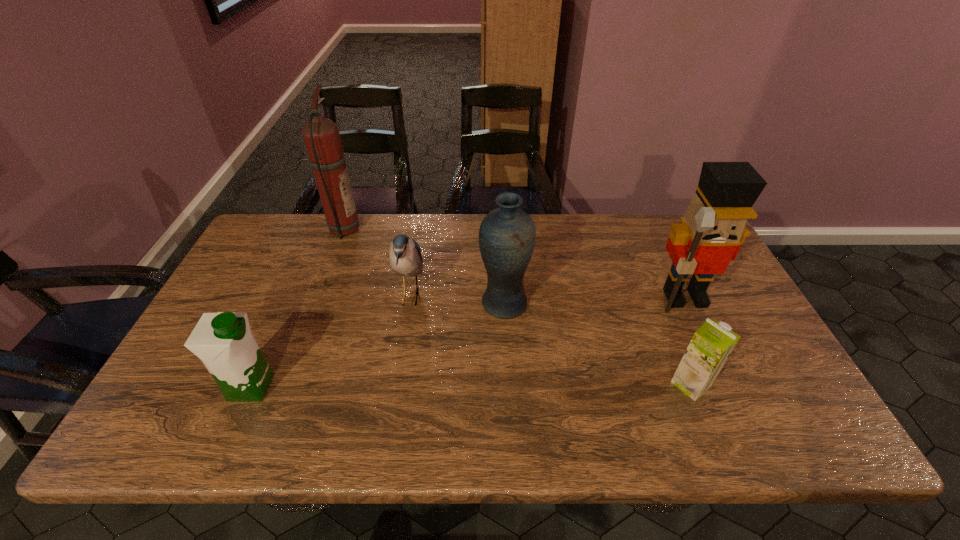
Find the location of `free space between the bird and the right soya milk`. free space between the bird and the right soya milk is located at coordinates (550, 340).

Select which object appears as the third closest to the vase. Please provide its 2D coordinates. Your answer should be formatted as a tuple, i.e. [(x, y)], where the tuple contains the x and y coordinates of a point satisfying the conditions above.

[(712, 230)]

The width and height of the screenshot is (960, 540). What are the coordinates of `object that can be found as the fourth closest to the nutcracker` in the screenshot? It's located at (321, 135).

In order to click on free location that satisfies the following two spatial constraints: 1. on the side of the farthest object with the label and nozzle; 2. on the back side of the right soya milk in this screenshot , I will do `click(282, 384)`.

You are a GUI agent. You are given a task and a screenshot of the screen. Output one action in this format:
    pyautogui.click(x=<x>, y=<y>)
    Task: Click on the vacant space that satisfies the following two spatial constraints: 1. at the tip of the fourth object from right to left's beak; 2. on the right side of the vase
    The width and height of the screenshot is (960, 540).
    Given the screenshot: What is the action you would take?
    pyautogui.click(x=409, y=305)

What are the coordinates of `free location that satisfies the following two spatial constraints: 1. at the tip of the third object from left to right's beak; 2. on the right side of the right soya milk` in the screenshot? It's located at (396, 384).